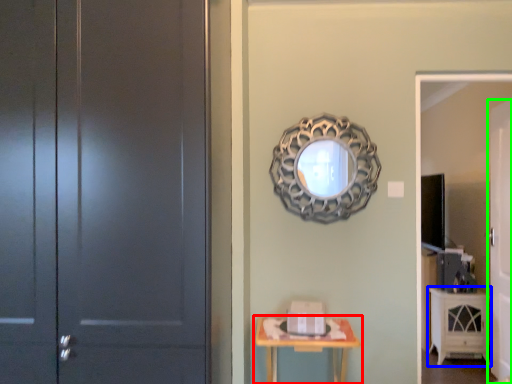
Question: Which is farther away from table (highlighted by a red box)? cabinetry (highlighted by a blue box) or door (highlighted by a green box)?

Choices:
 (A) cabinetry
 (B) door

Answer: (A)